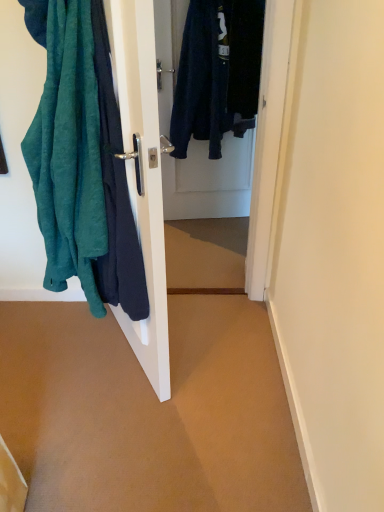
Locate an element on the screen. The image size is (384, 512). free location to the left of teal fabric at left is located at coordinates (62, 346).